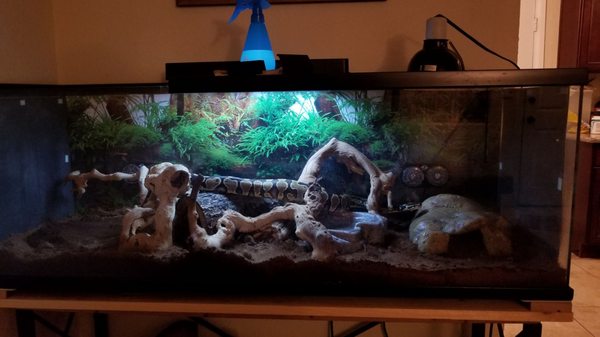
You are a GUI agent. You are given a task and a screenshot of the screen. Output one action in this format:
    pyautogui.click(x=<x>, y=<y>)
    Task: Click on the light
    The image size is (600, 337).
    Given the screenshot: What is the action you would take?
    pyautogui.click(x=290, y=78)